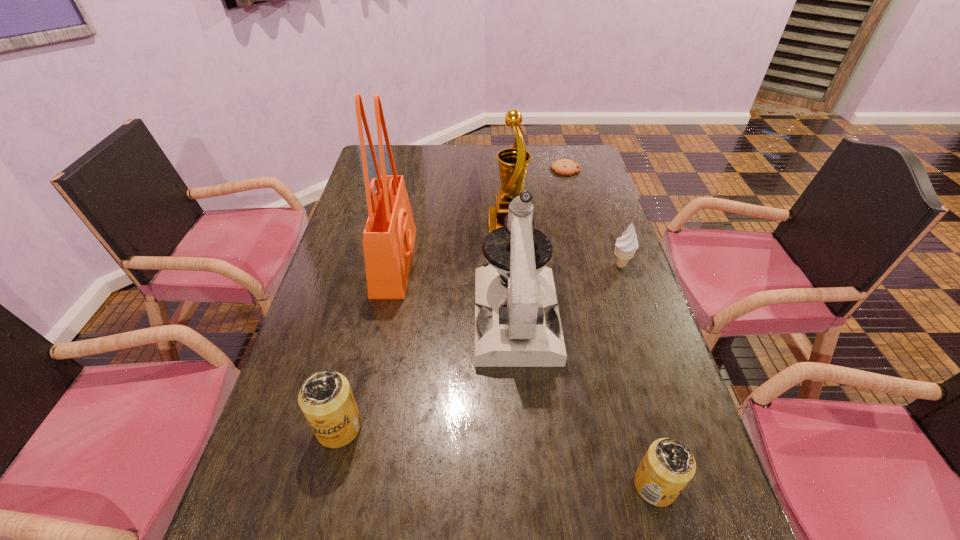
Image resolution: width=960 pixels, height=540 pixels. In order to click on vacant space located 0.090m on the left of the left beer can in this screenshot , I will do `click(275, 427)`.

Find the location of `vacant point located on the left of the shorter beer can`. vacant point located on the left of the shorter beer can is located at coordinates (551, 485).

Identify the location of free spot located 0.080m on the left of the shortest object. (530, 169).

You are a GUI agent. You are given a task and a screenshot of the screen. Output one action in this format:
    pyautogui.click(x=<x>, y=<y>)
    Task: Click on the vacant position located 0.320m on the logo side of the tote bag
    
    Given the screenshot: What is the action you would take?
    [x=519, y=262]

At what (x,y) coordinates should I click in order to perform the action: click on vacant region located on the front-facing side of the award. Please return your answer as a coordinate pair (x, y). Looking at the image, I should click on (428, 226).

Image resolution: width=960 pixels, height=540 pixels. What are the coordinates of `free space located on the front-facing side of the award` in the screenshot? It's located at (431, 226).

Locate an element on the screen. The width and height of the screenshot is (960, 540). free space located 0.130m on the front-facing side of the award is located at coordinates (449, 226).

This screenshot has width=960, height=540. In order to click on free region located 0.290m on the front-facing side of the rightmost object in this screenshot , I will do `click(513, 265)`.

You are a GUI agent. You are given a task and a screenshot of the screen. Output one action in this format:
    pyautogui.click(x=<x>, y=<y>)
    Task: Click on the blank space located 0.070m on the front-facing side of the rightmost object
    
    Given the screenshot: What is the action you would take?
    pyautogui.click(x=587, y=265)

The width and height of the screenshot is (960, 540). Identify the location of free region located on the front-facing side of the rightmost object. (533, 265).